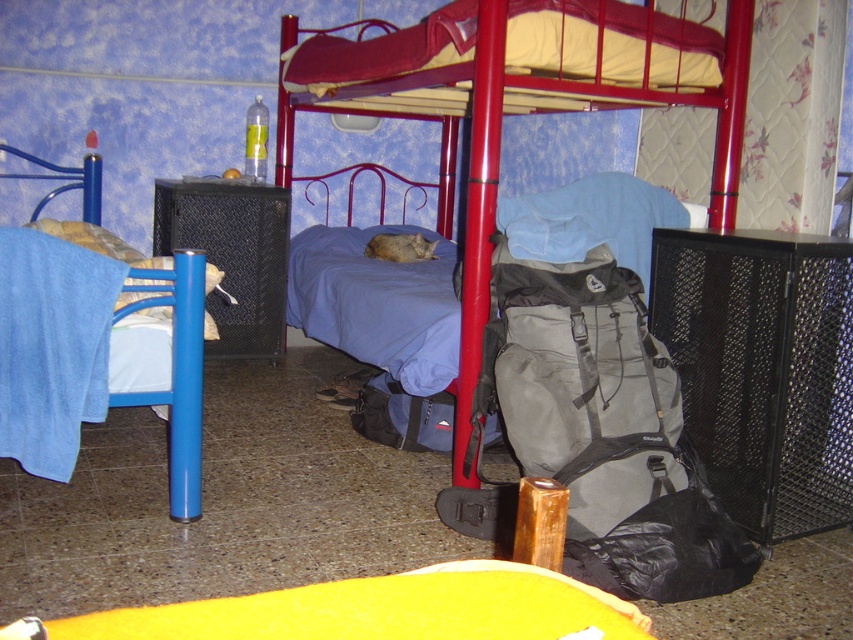
Question: Which of the following is the closest to the observer?

Choices:
 (A) (735, 124)
 (B) (184, 339)

Answer: (B)

Question: Is metallic red bunk bed at center thinner than blue fabric bed at left?

Choices:
 (A) no
 (B) yes

Answer: (A)

Question: Which point appears farthest from the camera in this image?

Choices:
 (A) (196, 266)
 (B) (370, 49)

Answer: (B)

Question: Can you confirm if metallic red bunk bed at center is positioned to the left of blue fabric bed at left?

Choices:
 (A) no
 (B) yes

Answer: (A)

Question: Is metallic red bunk bed at center wider than blue fabric bed at left?

Choices:
 (A) yes
 (B) no

Answer: (A)

Question: Which object is closer to the camera taking this photo?

Choices:
 (A) metallic red bunk bed at center
 (B) blue fabric bed at left

Answer: (A)